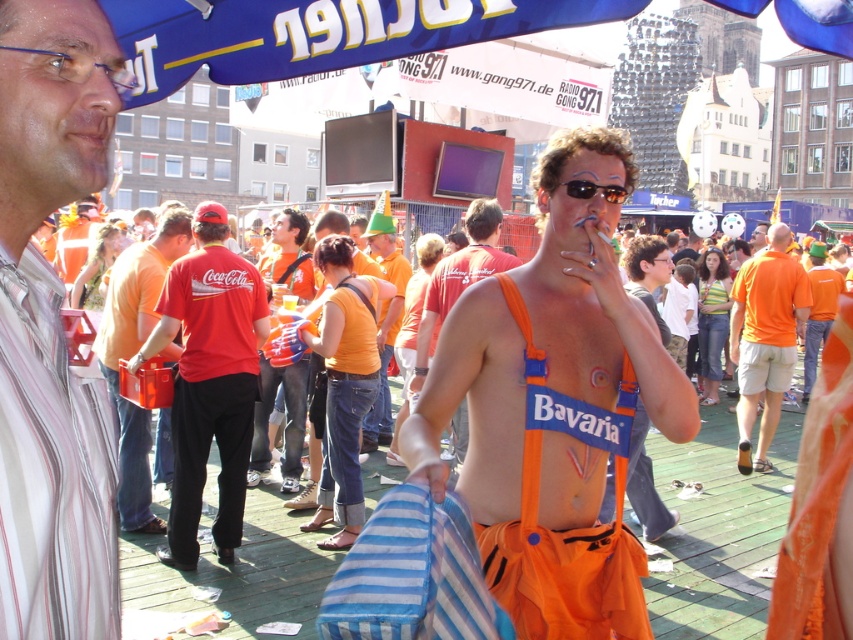
You are standing at the point labeled as point (219, 381) in the image. Looking towards the direction of the crowd, can you see the point labeled as point (505, 568) without any obstructions?

Yes, because point (505, 568) is in front of point (219, 381), so it would be visible from that position.

You are at the festival and want to take a photo of the orange fabric at center and the red cotton shirt at center. Which one should you focus on first if you want both to be in clear focus?

The orange fabric at center is in front of the red cotton shirt at center. To have both in clear focus, focus on the orange fabric at center first as it is closer, ensuring the depth of field captures both.

You are a photographer at the event and want to capture both the red cotton shirt at center and the orange cotton shirt at center in a single photo. If your camera can only focus on one shirt at a time, which shirt should you focus on to ensure it appears sharper in the photo?

The red cotton shirt at center is thinner than the orange cotton shirt at center, so focusing on the red cotton shirt at center would result in a sharper image because thinner objects are easier to focus on compared to thicker ones.